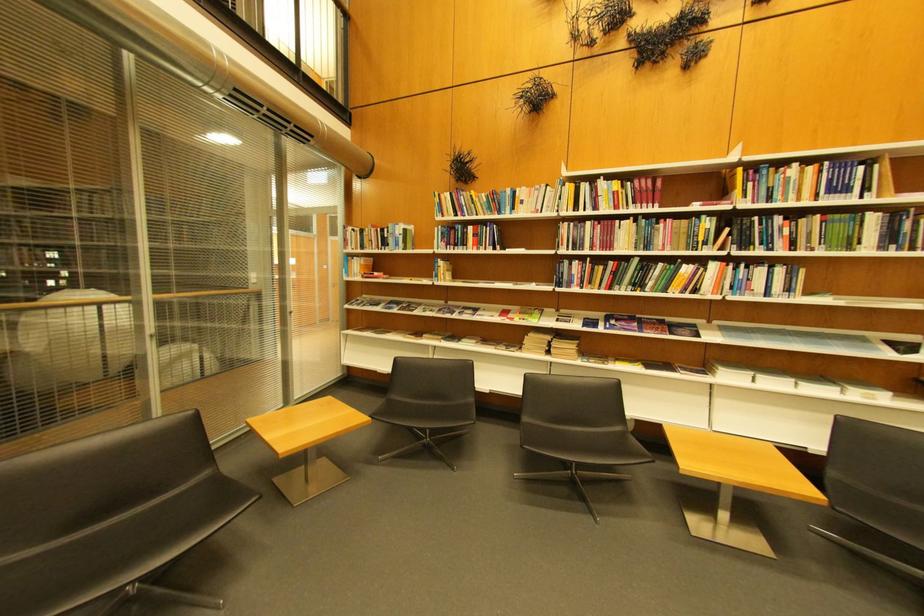
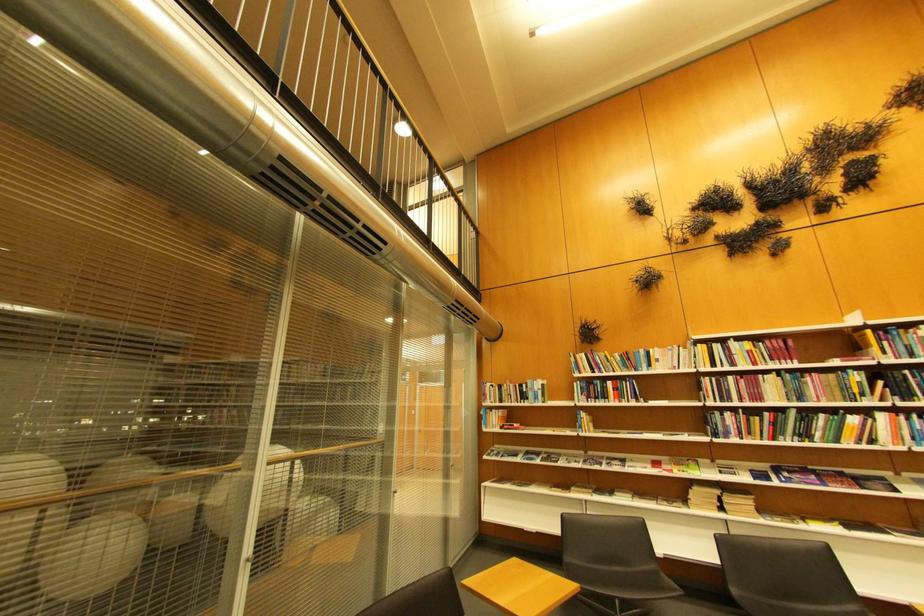
Find the pixel in the second image that matches pixel 750 171 in the first image.

(880, 333)